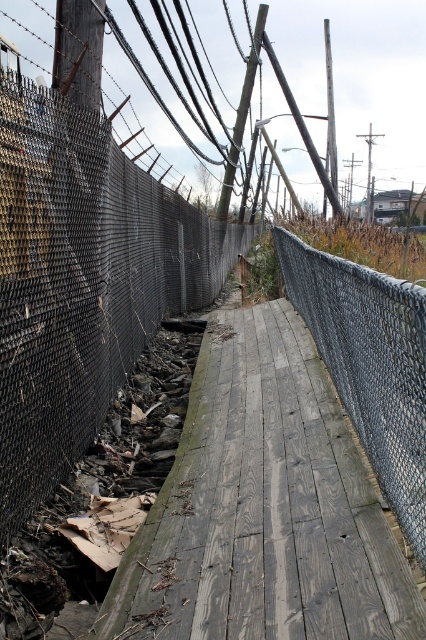
Which is more to the left, rusty metal fence at left or chain-link fence at center?

rusty metal fence at left is more to the left.

Is rusty metal fence at left in front of chain-link fence at center?

Yes.

Identify the location of rusty metal fence at left. (81, 282).